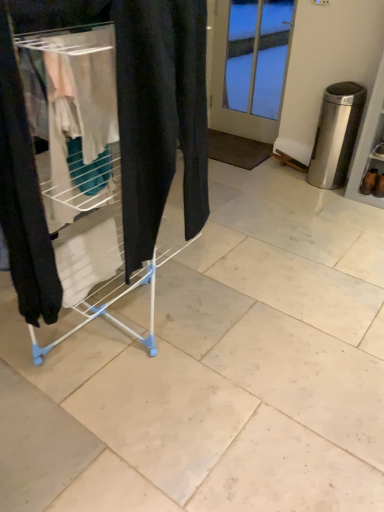
Question: From a real-world perspective, relative to white glass door at upper center, is satin silver trash can at right vertically above or below?

Choices:
 (A) below
 (B) above

Answer: (A)

Question: From the image's perspective, relative to white glass door at upper center, is satin silver trash can at right above or below?

Choices:
 (A) above
 (B) below

Answer: (B)

Question: Estimate the real-world distances between objects in this image. Which object is closer to the brown suede boot at lower right, the second footwear positioned from the left?

Choices:
 (A) white plastic drying rack at left
 (B) white glass door at upper center
 (C) brown suede boot at lower right, which is counted as the first footwear, starting from the left
 (D) satin silver trash can at right

Answer: (C)

Question: Which is farther from the brown suede boot at lower right, the 2th footwear positioned from the right?

Choices:
 (A) white plastic drying rack at left
 (B) satin silver trash can at right
 (C) brown suede boot at lower right, the second footwear positioned from the left
 (D) white glass door at upper center

Answer: (A)